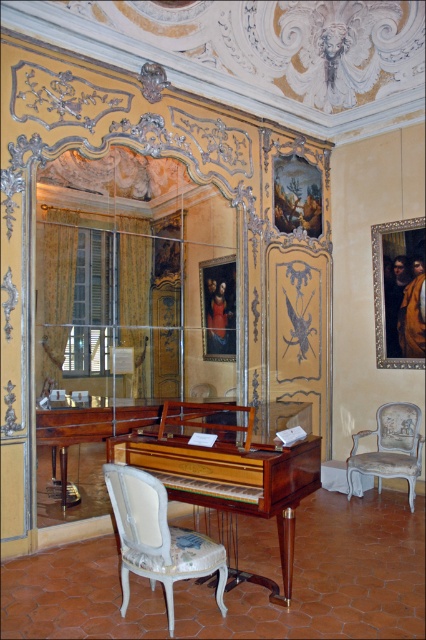
Can you confirm if mahogany polished piano at center is positioned to the left of white upholstered armchair at lower left?

No, mahogany polished piano at center is not to the left of white upholstered armchair at lower left.

Does mahogany polished piano at center appear on the right side of white upholstered armchair at lower left?

Correct, you'll find mahogany polished piano at center to the right of white upholstered armchair at lower left.

Locate an element on the screen. The height and width of the screenshot is (640, 426). mahogany polished piano at center is located at coordinates (227, 472).

Can you confirm if white upholstered armchair at lower left is shorter than light blue fabric armchair at lower right?

Yes, white upholstered armchair at lower left is shorter than light blue fabric armchair at lower right.

Which is above, white upholstered armchair at lower left or light blue fabric armchair at lower right?

white upholstered armchair at lower left is higher up.

Locate an element on the screen. white upholstered armchair at lower left is located at coordinates (158, 538).

Does mahogany polished piano at center appear over light blue fabric armchair at lower right?

Correct, mahogany polished piano at center is located above light blue fabric armchair at lower right.

Where is `mahogany polished piano at center`? Image resolution: width=426 pixels, height=640 pixels. mahogany polished piano at center is located at coordinates (227, 472).

Between point (311, 445) and point (363, 432), which one is positioned behind?

The point (363, 432) is more distant.

In order to click on mahogany polished piano at center in this screenshot , I will do `click(227, 472)`.